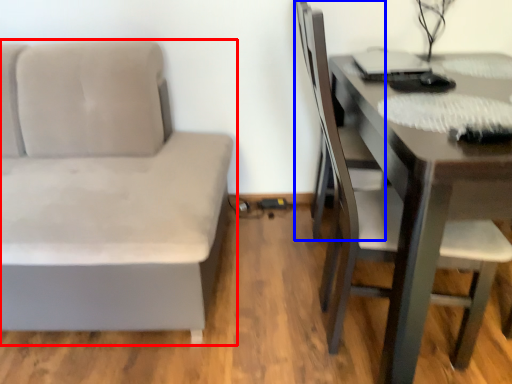
Question: Which point is closer to the camera, studio couch (highlighted by a red box) or swivel chair (highlighted by a blue box)?

Choices:
 (A) studio couch
 (B) swivel chair

Answer: (A)